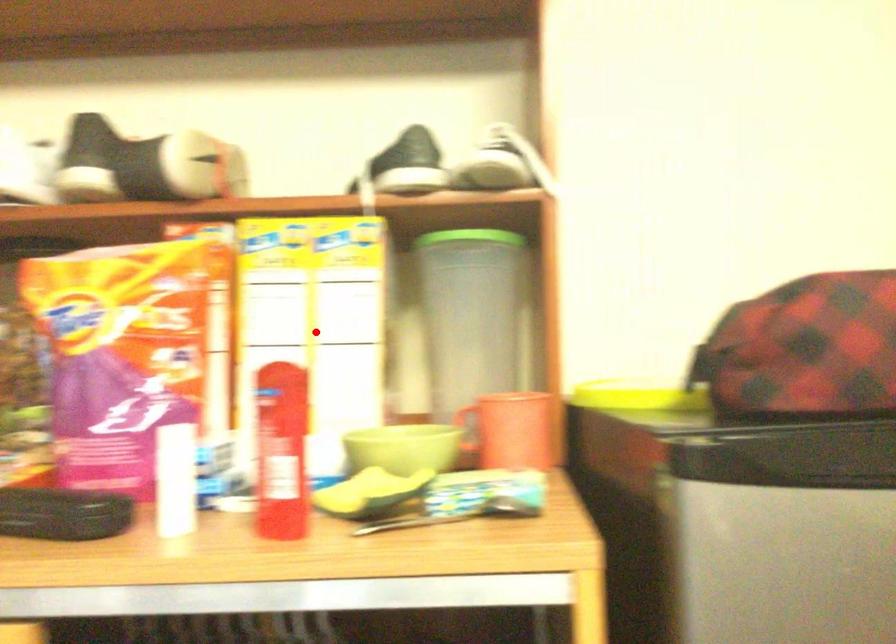
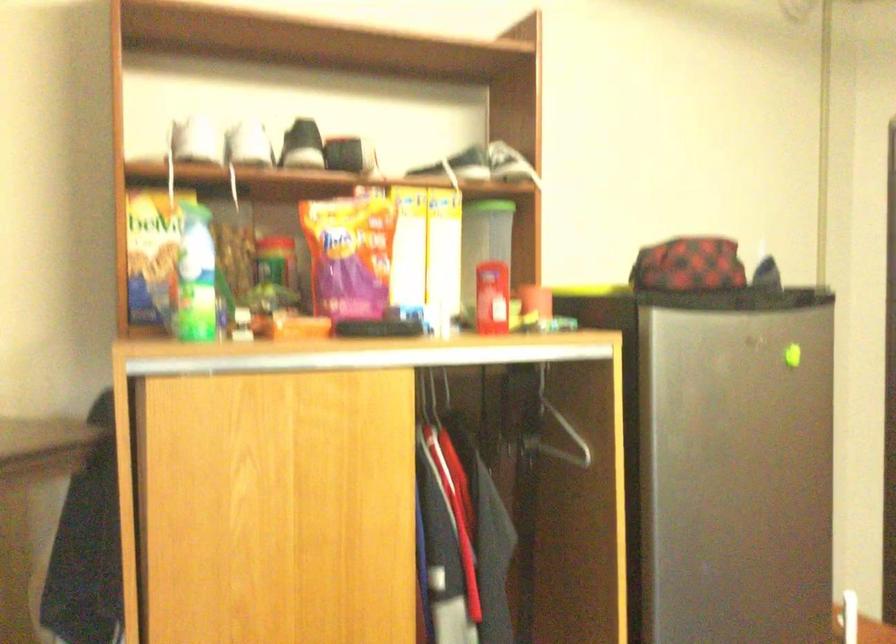
Question: I am providing you with two images of the same scene from different viewpoints. Given a red point in image1, look at the same physical point in image2. Is it:

Choices:
 (A) Closer to the viewpoint
 (B) Farther from the viewpoint

Answer: (B)